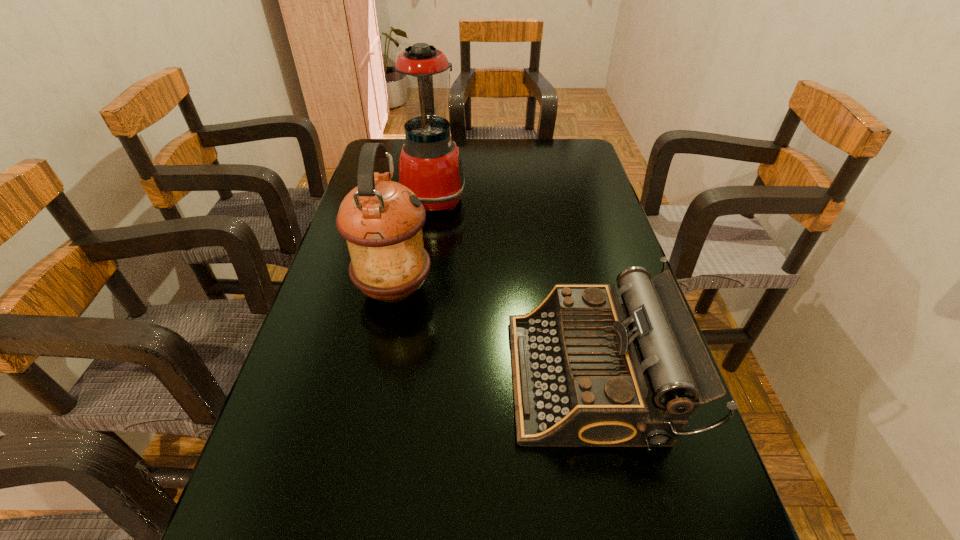
Where is `food processor at the left edge`? The image size is (960, 540). food processor at the left edge is located at coordinates (430, 165).

Image resolution: width=960 pixels, height=540 pixels. Find the location of `oil lamp positioned at the left edge`. oil lamp positioned at the left edge is located at coordinates (381, 220).

This screenshot has height=540, width=960. I want to click on object that is at the right edge, so click(592, 367).

In the image, there is a desktop. Where is `vacant space at the left edge`? Image resolution: width=960 pixels, height=540 pixels. vacant space at the left edge is located at coordinates (251, 488).

What are the coordinates of `free space at the right edge of the desktop` in the screenshot? It's located at (613, 213).

Identify the location of free space at the far right corner of the desktop. The height and width of the screenshot is (540, 960). (591, 167).

The width and height of the screenshot is (960, 540). In order to click on vacant area that lies between the food processor and the typewriter in this screenshot , I will do `click(513, 287)`.

Where is `vacant space that's between the typewriter and the second tallest object`? vacant space that's between the typewriter and the second tallest object is located at coordinates (492, 333).

You are a GUI agent. You are given a task and a screenshot of the screen. Output one action in this format:
    pyautogui.click(x=<x>, y=<y>)
    Task: Click on the free space between the oil lamp and the shortest object
    
    Given the screenshot: What is the action you would take?
    pyautogui.click(x=492, y=333)

You are a GUI agent. You are given a task and a screenshot of the screen. Output one action in this format:
    pyautogui.click(x=<x>, y=<y>)
    Task: Click on the vacant area between the shortest object and the oil lamp
    The height and width of the screenshot is (540, 960).
    Given the screenshot: What is the action you would take?
    pyautogui.click(x=492, y=333)